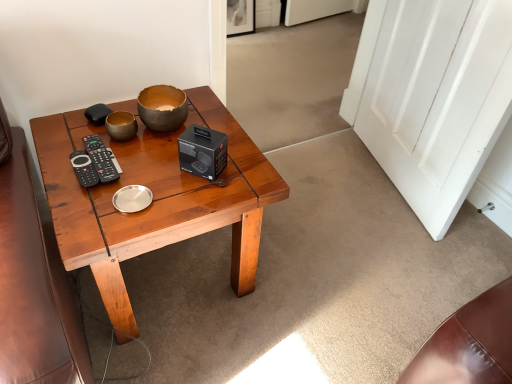
Where is `free location to the right of matte brown bowl at center`? The width and height of the screenshot is (512, 384). free location to the right of matte brown bowl at center is located at coordinates (215, 122).